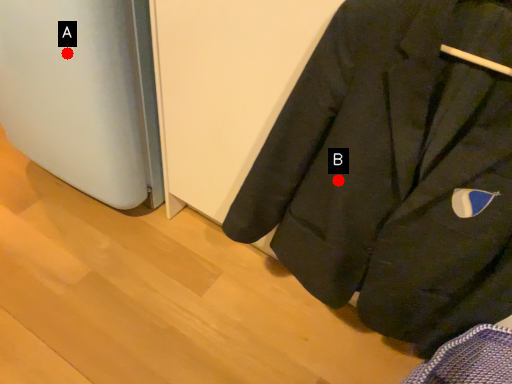
Question: Two points are circled on the image, labeled by A and B beside each circle. Among these points, which one is farthest from the camera?

Choices:
 (A) A is further
 (B) B is further

Answer: (A)